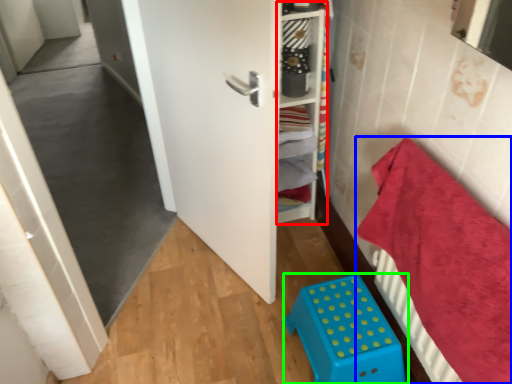
Question: Considering the real-world distances, which object is closest to shelf (highlighted by a red box)? bedding (highlighted by a blue box) or furniture (highlighted by a green box).

Choices:
 (A) bedding
 (B) furniture

Answer: (A)